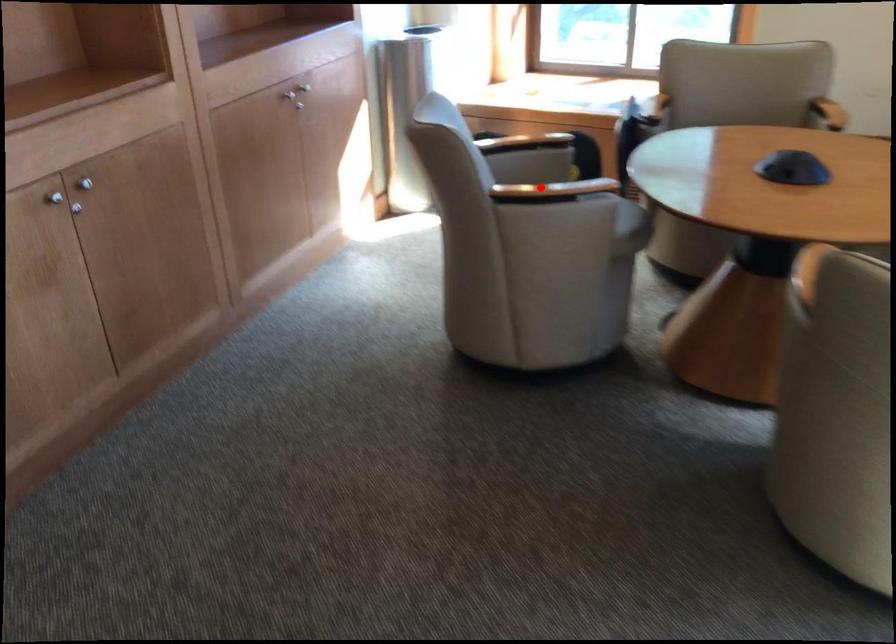
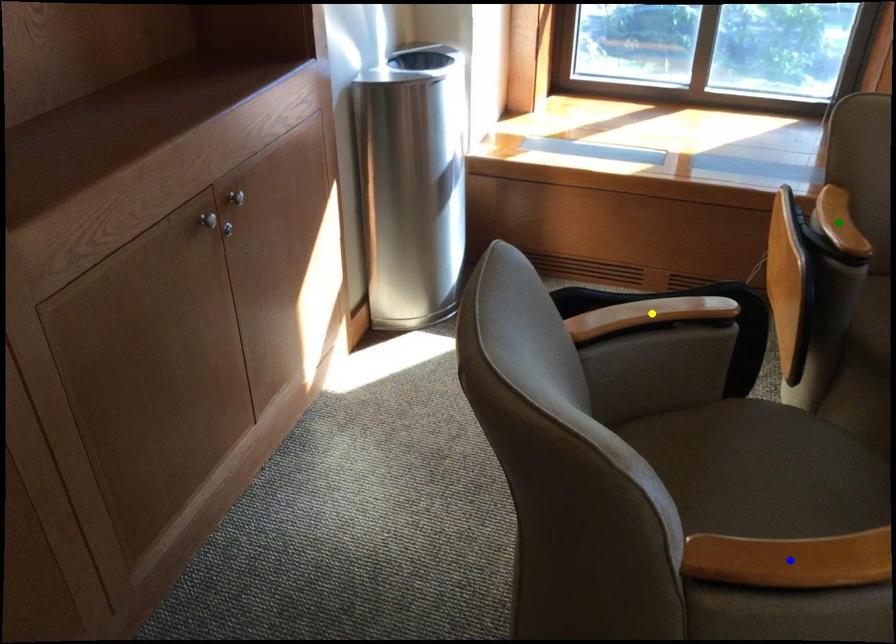
Question: I am providing you with two images of the same scene from different viewpoints. A red point is marked on the first image. You are given multiple points on the second image. Can you choose the point in image 2 that corresponds to the point in image 1?

Choices:
 (A) green point
 (B) yellow point
 (C) blue point

Answer: (C)